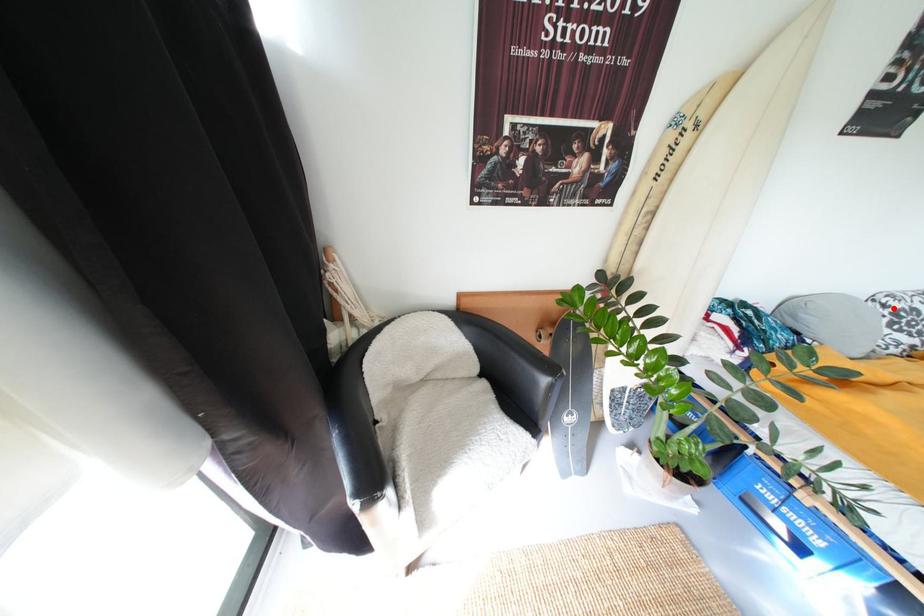
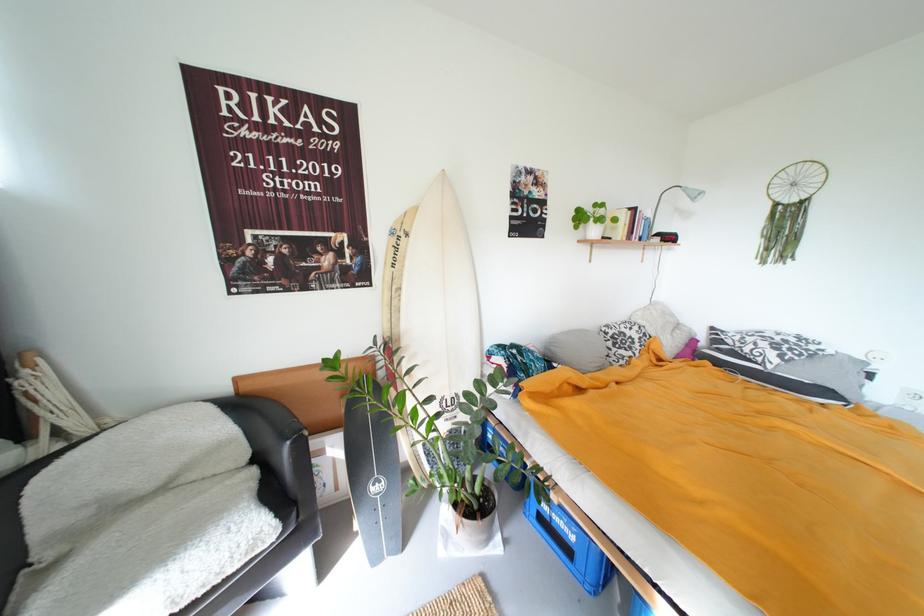
The point at the highlighted location is marked in the first image. Where is the corresponding point in the second image?

(614, 334)